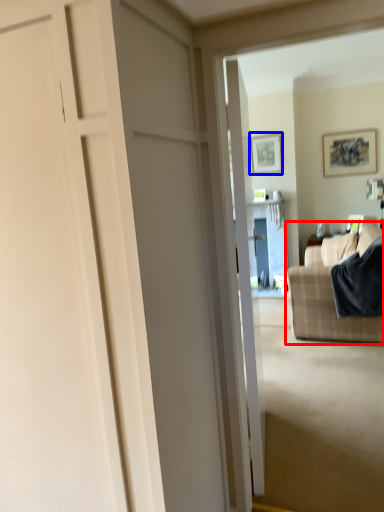
Question: Which object is further to the camera taking this photo, studio couch (highlighted by a red box) or picture frame (highlighted by a blue box)?

Choices:
 (A) studio couch
 (B) picture frame

Answer: (B)